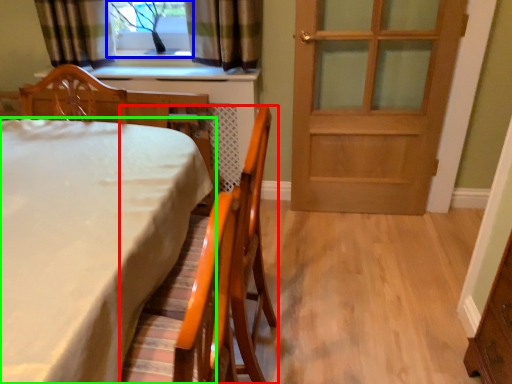
Question: Estimate the real-world distances between objects in this image. Which object is farther from chair (highlighted by a red box), window (highlighted by a blue box) or table (highlighted by a green box)?

Choices:
 (A) window
 (B) table

Answer: (A)